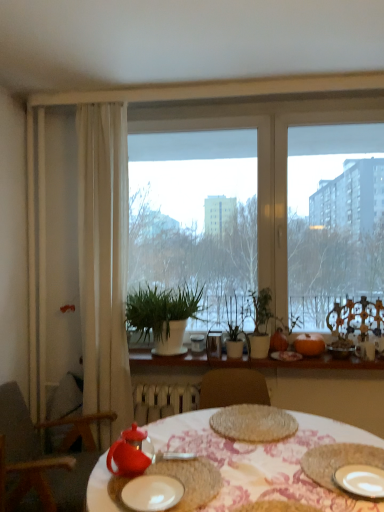
The width and height of the screenshot is (384, 512). Find the location of `vacant area that lies between rustic woven placemat at lower right and matte red teapot at lower center, placed as the 1th tableware when sorted from left to right`. vacant area that lies between rustic woven placemat at lower right and matte red teapot at lower center, placed as the 1th tableware when sorted from left to right is located at coordinates (246, 471).